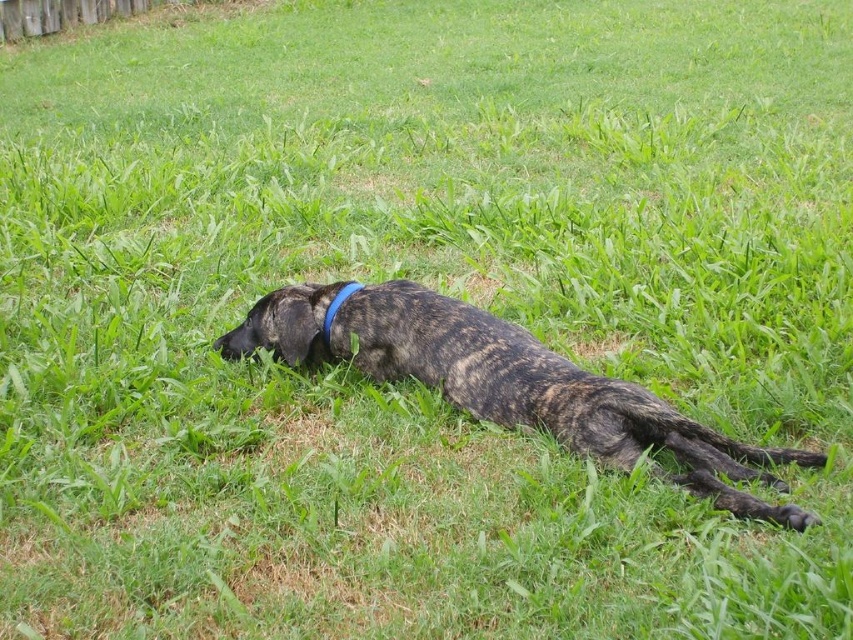
You are a dog groomer assessing the space needed to clean the brindle fur dog at center and the blue fabric neckband at center. Which object requires more width for cleaning?

The brindle fur dog at center might be wider than blue fabric neckband at center, so it requires more width for cleaning.

You are a veterinarian examining an image of a dog. You need to determine if the blue fabric neckband at center is too small for the brindle fur dog at center. Based on the size comparison between the two, what is your assessment?

The brindle fur dog at center has a larger size compared to the blue fabric neckband at center, so the blue fabric neckband at center is likely too small for the dog.